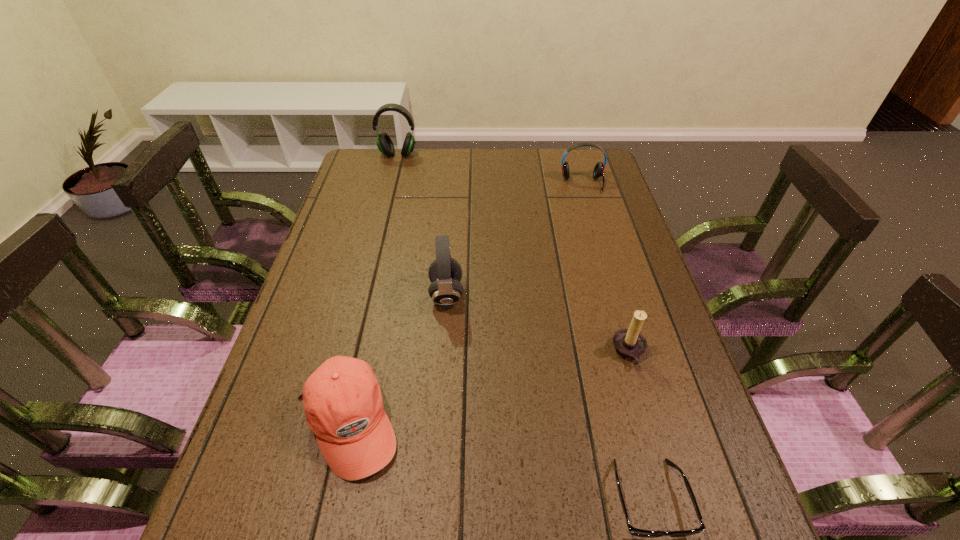
At what (x,y) coordinates should I click in order to perform the action: click on the farthest object. Please return your answer as a coordinate pair (x, y). Looking at the image, I should click on (385, 145).

Identify the location of the farthest headset. The width and height of the screenshot is (960, 540). (385, 145).

I want to click on the fourth nearest object, so click(445, 273).

Where is `the nearest headset`? The height and width of the screenshot is (540, 960). the nearest headset is located at coordinates (445, 273).

Identify the location of the rightmost headset. (598, 171).

You are a GUI agent. You are given a task and a screenshot of the screen. Output one action in this format:
    pyautogui.click(x=<x>, y=<y>)
    Task: Click on the fifth nearest object
    
    Given the screenshot: What is the action you would take?
    pyautogui.click(x=598, y=171)

Locate an element on the screen. candle holder is located at coordinates (629, 343).

Where is `baseball cap`? The height and width of the screenshot is (540, 960). baseball cap is located at coordinates (342, 399).

Image resolution: width=960 pixels, height=540 pixels. In order to click on vacant space located on the ear cups of the farthest object in this screenshot , I will do `click(382, 215)`.

Where is `free space located on the ear cups of the third farthest object`? The height and width of the screenshot is (540, 960). free space located on the ear cups of the third farthest object is located at coordinates (x=537, y=294).